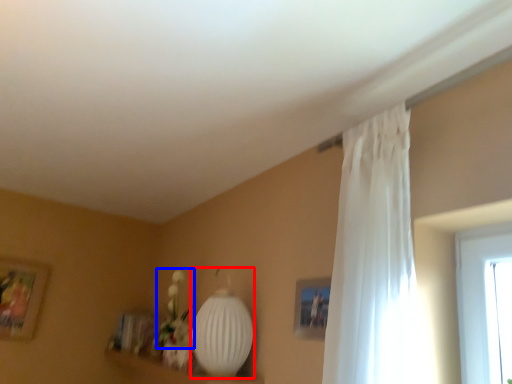
Question: Which point is closer to the camera, lamp (highlighted by a red box) or floral arrangement (highlighted by a blue box)?

Choices:
 (A) lamp
 (B) floral arrangement

Answer: (A)